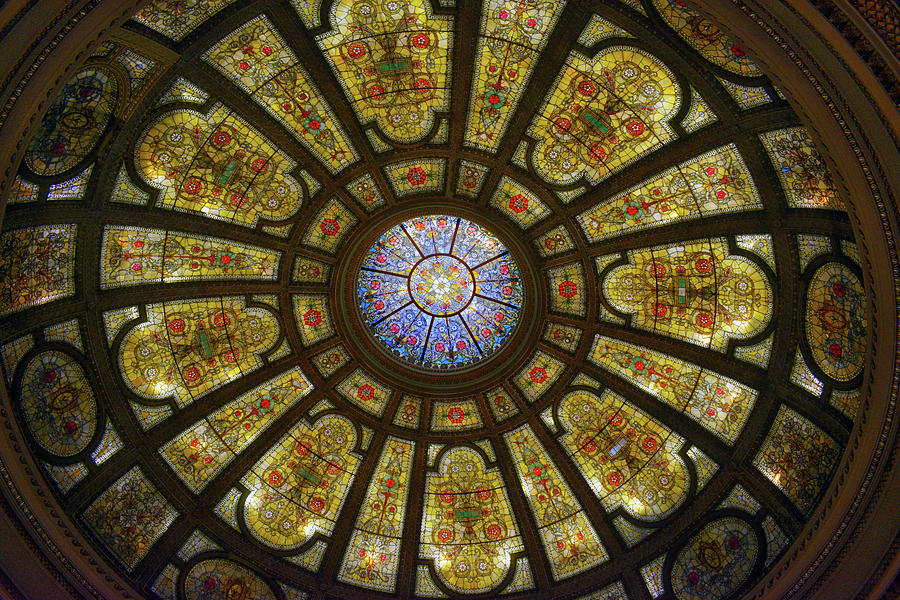
Where is `ceiling`? The image size is (900, 600). ceiling is located at coordinates (457, 274).